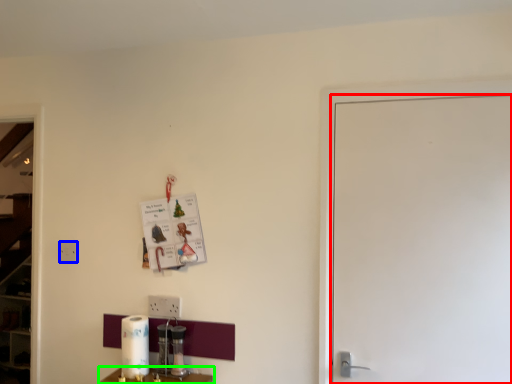
Question: Considering the real-world distances, which object is farthest from door (highlighted by a red box)? electric outlet (highlighted by a blue box) or furniture (highlighted by a green box)?

Choices:
 (A) electric outlet
 (B) furniture

Answer: (A)